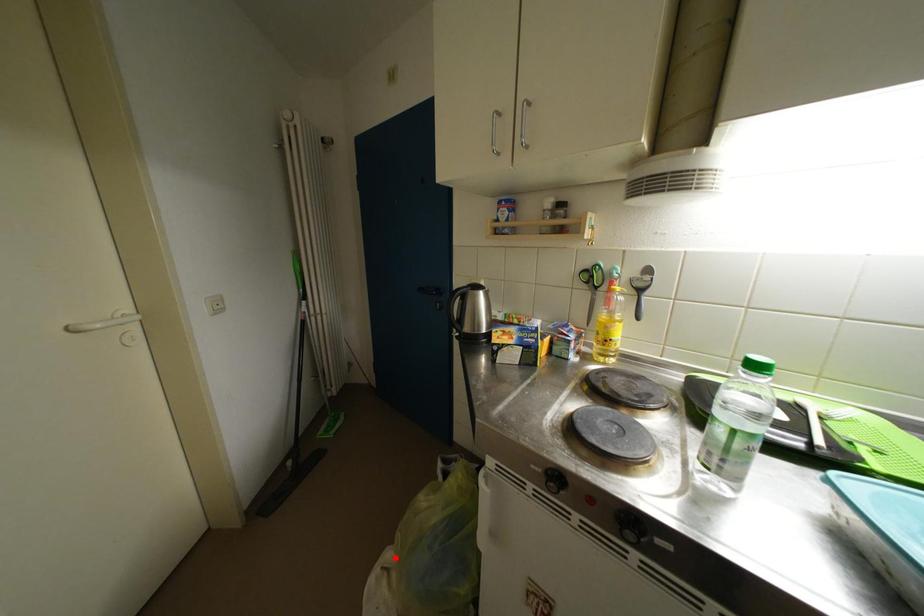
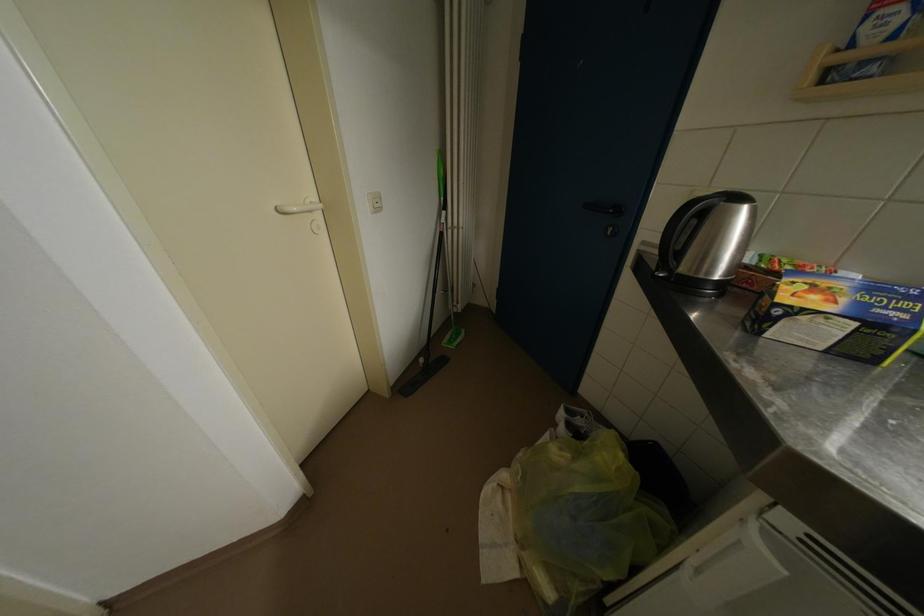
Question: A red point is marked in image1. In image2, is the corresponding 3D point closer to the camera or farther? Reply with the corresponding letter.

Choices:
 (A) The corresponding 3D point is closer.
 (B) The corresponding 3D point is farther.

Answer: (A)